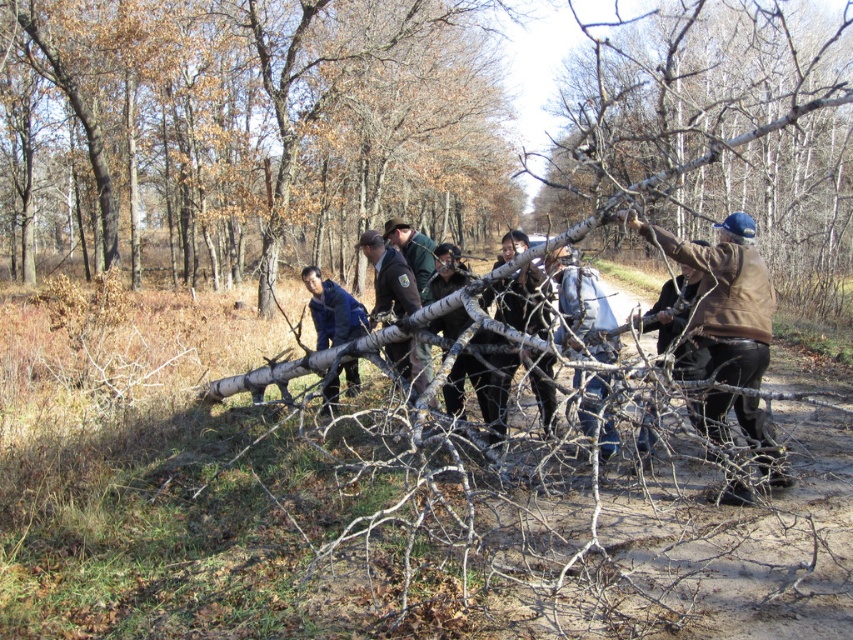
Can you confirm if brown leather jacket at right is bigger than brown uniform at center?

Yes.

Which is behind, point (737, 273) or point (408, 288)?

The point (408, 288) is more distant.

Where is `brown leather jacket at right`? The image size is (853, 640). brown leather jacket at right is located at coordinates (724, 298).

This screenshot has height=640, width=853. I want to click on brown leather jacket at right, so click(x=724, y=298).

Does brown uniform at center have a lesser height compared to blue fabric jacket at center?

Yes, brown uniform at center is shorter than blue fabric jacket at center.

Does brown uniform at center appear under blue fabric jacket at center?

No.

Between point (392, 344) and point (329, 406), which one is positioned in front?

Point (392, 344)

Where is `brown uniform at center`? brown uniform at center is located at coordinates (389, 276).

Does brown bark tree at center have a larger size compared to denim jeans at center?

Yes, brown bark tree at center is bigger than denim jeans at center.

Between point (172, 42) and point (581, 332), which one is positioned in front?

Point (581, 332) is in front.

Where is `brown bark tree at center`? brown bark tree at center is located at coordinates (244, 128).